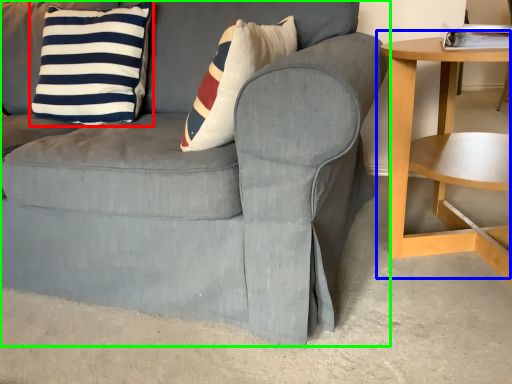
Question: Based on their relative distances, which object is nearer to pillow (highlighted by a red box)? Choose from table (highlighted by a blue box) and chair (highlighted by a green box).

Choices:
 (A) table
 (B) chair

Answer: (B)